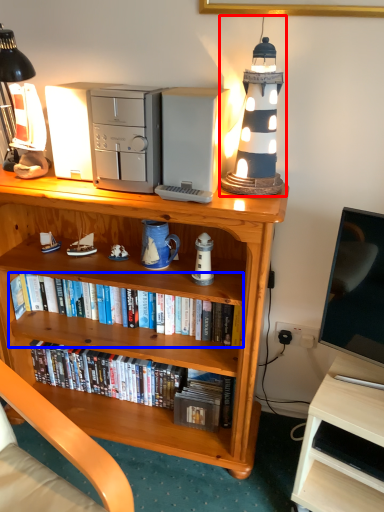
Question: Which object is further to the camera taking this photo, table lamp (highlighted by a red box) or book (highlighted by a blue box)?

Choices:
 (A) table lamp
 (B) book

Answer: (B)